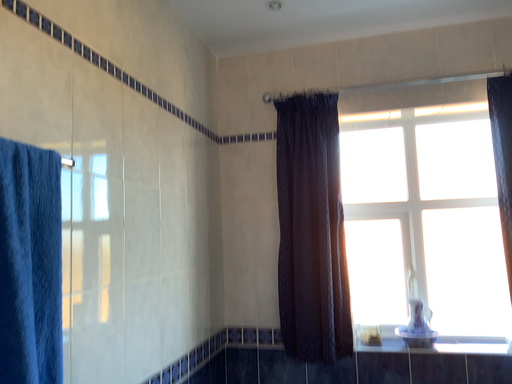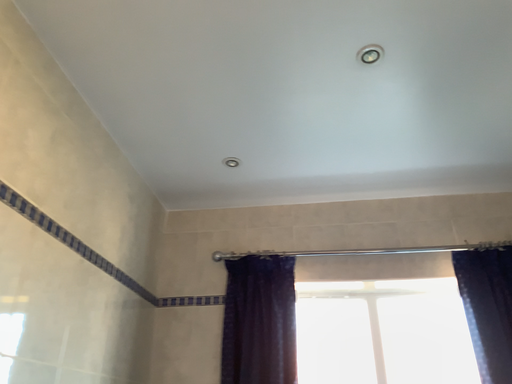
Question: How did the camera likely rotate when shooting the video?

Choices:
 (A) rotated upward
 (B) rotated downward

Answer: (A)